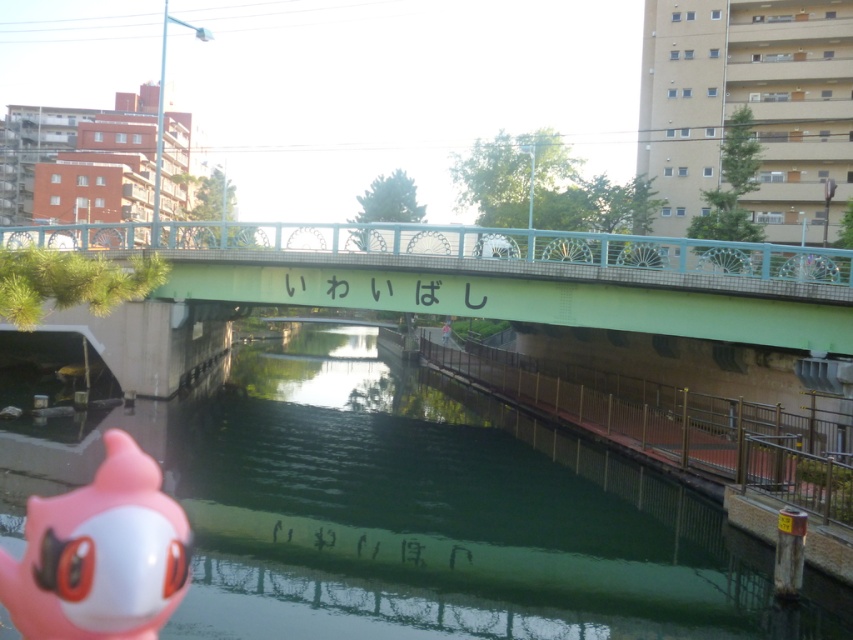
Question: Does green smooth water at center lie behind pink rubber toy at lower left?

Choices:
 (A) no
 (B) yes

Answer: (A)

Question: Which point is farther from the camera taking this photo?

Choices:
 (A) (39, 502)
 (B) (585, 298)
 (C) (223, 493)
 (D) (614, 403)

Answer: (B)

Question: Which point is closer to the camera?

Choices:
 (A) pink rubber toy at lower left
 (B) green concrete bridge at center

Answer: (A)

Question: Estimate the real-world distances between objects in this image. Which object is closer to the pink rubber toy at lower left?

Choices:
 (A) green concrete bridge at center
 (B) green smooth water at center

Answer: (B)

Question: Where is green smooth water at center located in relation to brown metal railing at lower right in the image?

Choices:
 (A) below
 (B) above

Answer: (A)

Question: Is green smooth water at center thinner than pink rubber toy at lower left?

Choices:
 (A) no
 (B) yes

Answer: (A)